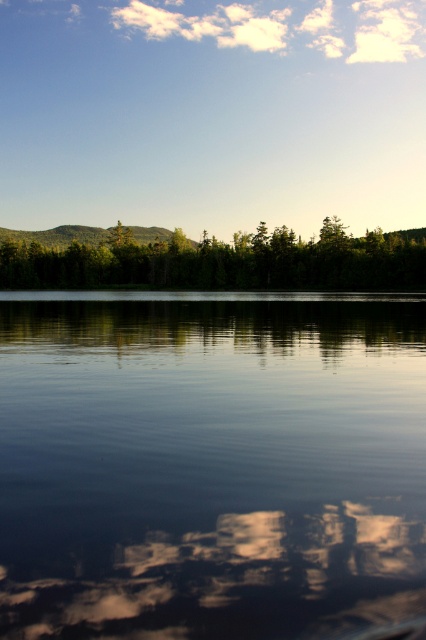
Based on the photo, you are a photographer standing at the edge of the transparent water at center and want to capture the green leafy trees at center in your shot. Since the trees are part of the midground, which direction should you move to ensure they are centered in your frame while keeping the water visible?

The transparent water at center is positioned on the right side of green leafy trees at center. To center the green leafy trees at center in your frame while keeping the transparent water at center visible, you should move to the left so that the trees are centered and the water remains on the right side of the frame.

You are standing at the center of the image and want to reach the point marked as point (210, 465). Describe the path you would take to get there, considering the presence of transparent water at center.

The point (210, 465) is located at the transparent water at center, so you can walk directly towards the transparent water at center to reach the desired point.

Looking at this image, you are an artist trying to paint the scene. You want to ensure the transparent water at center and the green leafy trees at center are proportionally accurate. Which object should you paint larger?

The green leafy trees at center should be painted larger because the transparent water at center occupies less space than green leafy trees at center.